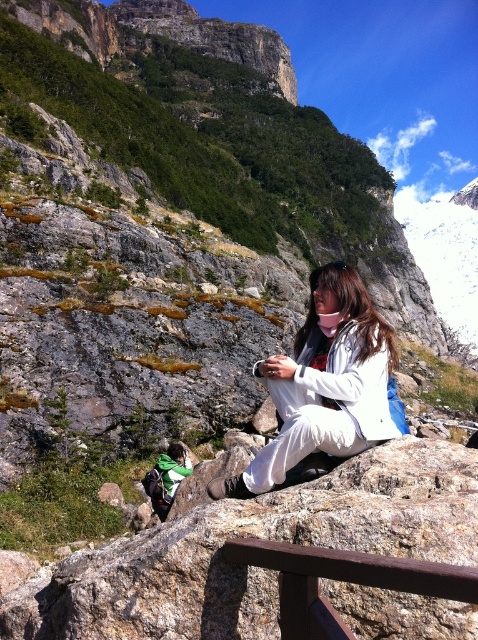
You are a hiker who just arrived at the rocky ledge. You see the white matte jacket at center and the brown wood rail at lower center. Which object is positioned higher from the ground?

The white matte jacket at center is above the brown wood rail at lower center, so it is positioned higher from the ground.

You are a hiker who wants to reach the brown wood rail at lower center from your current position near the white matte jacket at center. The path between them is narrow and rocky. Can you safely walk to the rail if you can manage paths narrower than 40 feet?

The distance between the white matte jacket at center and the brown wood rail at lower center is 37.58 feet, which is less than 40 feet. Therefore, you can safely walk to the rail if you can manage paths narrower than 40 feet.

You are a photographer planning to take a photo of the white matte jacket at center from the camera position. Given that the camera has a maximum focus range of 100 feet, will you be able to capture the jacket in focus?

The white matte jacket at center and camera are 107.92 feet apart, which exceeds the camera maximum focus range of 100 feet. Therefore, you will not be able to capture the jacket in focus.